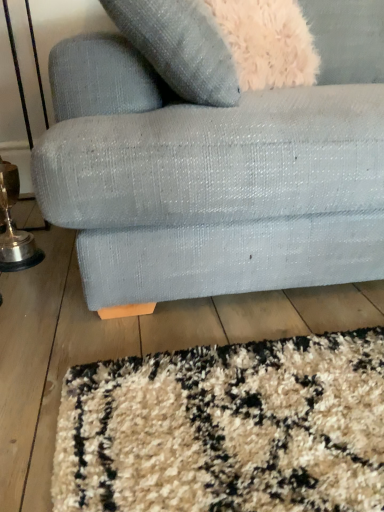
Image resolution: width=384 pixels, height=512 pixels. What are the coordinates of `spots to the right of gold metallic table lamp at lower left` in the screenshot? It's located at (58, 265).